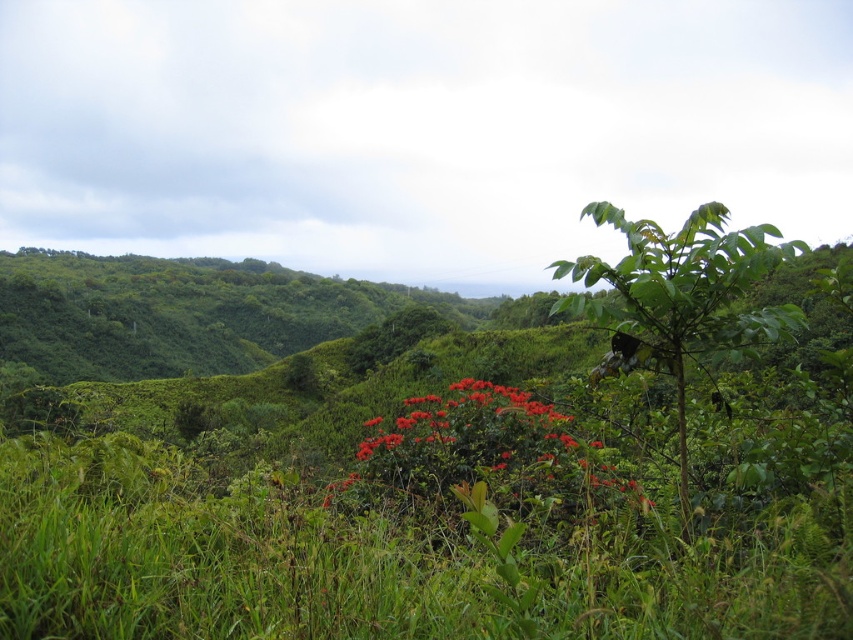
Question: Can you confirm if green leafy tree at center-right is bigger than bright red petals at center?

Choices:
 (A) no
 (B) yes

Answer: (B)

Question: Which point appears farthest from the camera in this image?

Choices:
 (A) (683, 323)
 (B) (445, 508)

Answer: (B)

Question: Which object is farther from the camera taking this photo?

Choices:
 (A) bright red petals at center
 (B) green leafy tree at center-right

Answer: (B)

Question: Is green leafy tree at center-right bigger than bright red petals at center?

Choices:
 (A) no
 (B) yes

Answer: (B)

Question: Does green leafy tree at center-right have a larger size compared to bright red petals at center?

Choices:
 (A) no
 (B) yes

Answer: (B)